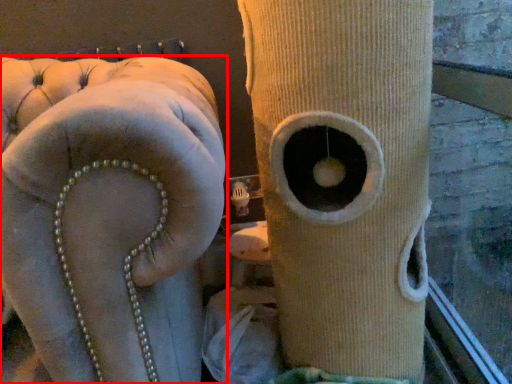
Question: From the image's perspective, considering the relative positions of furniture (annotated by the red box) and tree trunk in the image provided, where is furniture (annotated by the red box) located with respect to the staircase?

Choices:
 (A) below
 (B) above

Answer: (A)